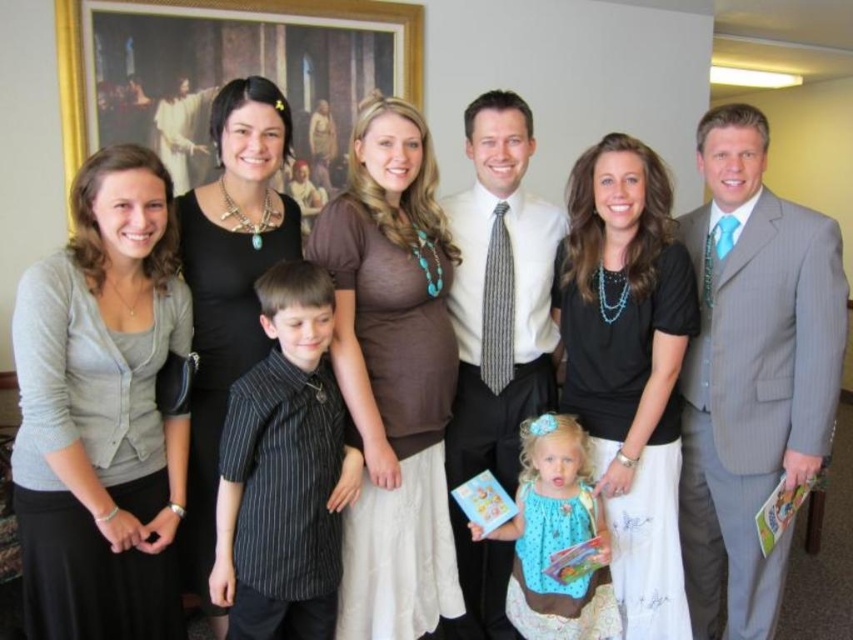
Question: In this image, where is black matte dress at center located relative to polka dot fabric dress at center?

Choices:
 (A) left
 (B) right

Answer: (A)

Question: Is brown fabric dress at center bigger than wooden framed picture at upper center?

Choices:
 (A) yes
 (B) no

Answer: (B)

Question: Which object is the farthest from the gray cardigan at left?

Choices:
 (A) wooden framed picture at upper center
 (B) black matte dress at center
 (C) polka dot fabric dress at center

Answer: (A)

Question: Does brown fabric dress at center lie behind wooden framed picture at upper center?

Choices:
 (A) no
 (B) yes

Answer: (A)

Question: Which of the following is the farthest from the observer?

Choices:
 (A) wooden framed picture at upper center
 (B) polka dot fabric dress at center
 (C) brown fabric dress at center
 (D) gray cardigan at left

Answer: (A)

Question: Considering the real-world distances, which object is farthest from the black fabric dress at center?

Choices:
 (A) brown fabric dress at center
 (B) black pinstripe shirt at center
 (C) black matte dress at center
 (D) polka dot fabric dress at center

Answer: (C)